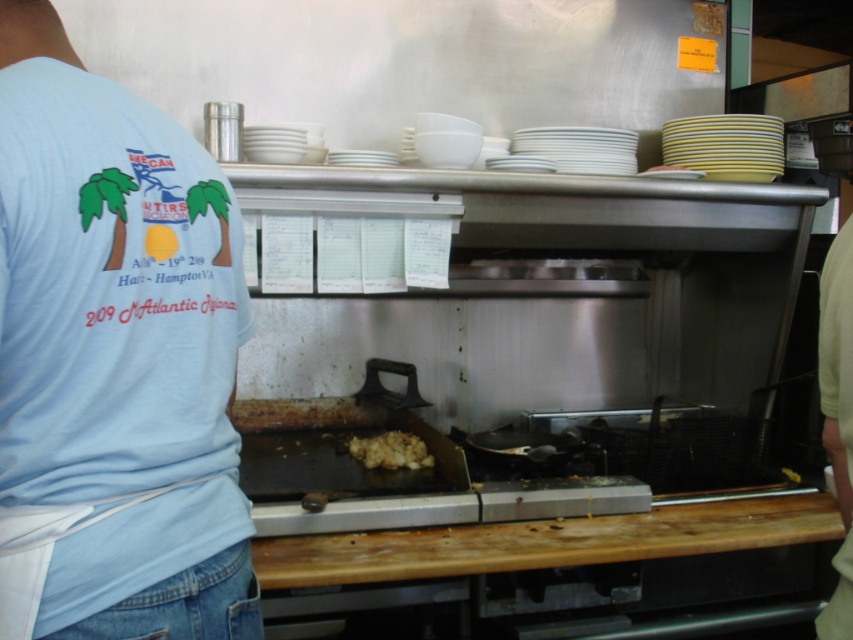
What are the coordinates of the light blue fabric shirt at upper left?

The light blue fabric shirt at upper left is located at point (113, 358).

You are a customer looking at the kitchen scene. Which object is taller between the light blue fabric shirt at upper left and the brown crumbly food at center?

The light blue fabric shirt at upper left is taller than the brown crumbly food at center.